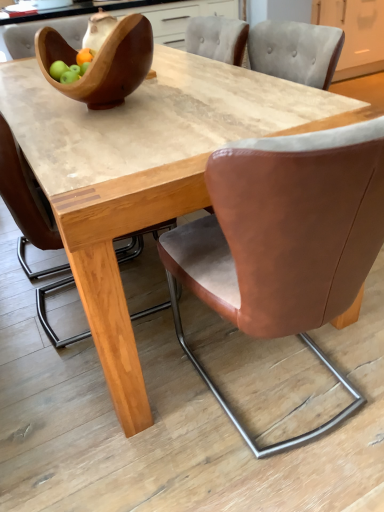
Question: Does wooden bowl at upper left have a larger size compared to brown leather chair at center, which ranks as the second chair in left-to-right order?

Choices:
 (A) no
 (B) yes

Answer: (A)

Question: Is wooden bowl at upper left surrounding brown leather chair at center, which ranks as the second chair in left-to-right order?

Choices:
 (A) yes
 (B) no

Answer: (B)

Question: From the image's perspective, is wooden bowl at upper left beneath brown leather chair at center, which ranks as the second chair in left-to-right order?

Choices:
 (A) no
 (B) yes

Answer: (A)

Question: Is wooden bowl at upper left completely or partially outside of brown leather chair at center, the first chair viewed from the right?

Choices:
 (A) yes
 (B) no

Answer: (A)

Question: Can you confirm if wooden bowl at upper left is shorter than brown leather chair at center, which ranks as the second chair in left-to-right order?

Choices:
 (A) yes
 (B) no

Answer: (A)

Question: Is matte gray cabinet at upper right taller or shorter than wooden bowl at upper left?

Choices:
 (A) tall
 (B) short

Answer: (A)

Question: Considering the relative positions of matte gray cabinet at upper right and wooden bowl at upper left in the image provided, is matte gray cabinet at upper right to the left or to the right of wooden bowl at upper left?

Choices:
 (A) left
 (B) right

Answer: (B)

Question: From a real-world perspective, is matte gray cabinet at upper right physically located above or below wooden bowl at upper left?

Choices:
 (A) above
 (B) below

Answer: (B)

Question: Is point (339, 70) closer or farther from the camera than point (43, 71)?

Choices:
 (A) farther
 (B) closer

Answer: (A)

Question: From the image's perspective, is brown leather chair at center, which appears as the 1th chair when viewed from the left, above or below wooden bowl at upper left?

Choices:
 (A) above
 (B) below

Answer: (B)

Question: Looking at their shapes, would you say brown leather chair at center, the second chair from the right, is wider or thinner than wooden bowl at upper left?

Choices:
 (A) wide
 (B) thin

Answer: (A)

Question: From their relative heights in the image, would you say brown leather chair at center, the second chair from the right, is taller or shorter than wooden bowl at upper left?

Choices:
 (A) short
 (B) tall

Answer: (B)

Question: Do you think brown leather chair at center, which appears as the 1th chair when viewed from the left, is within wooden bowl at upper left, or outside of it?

Choices:
 (A) inside
 (B) outside

Answer: (B)

Question: Is matte gray cabinet at upper right wider or thinner than brown leather chair at center, which appears as the 1th chair when viewed from the left?

Choices:
 (A) wide
 (B) thin

Answer: (A)

Question: In the image, is matte gray cabinet at upper right on the left side or the right side of brown leather chair at center, which appears as the 1th chair when viewed from the left?

Choices:
 (A) left
 (B) right

Answer: (B)